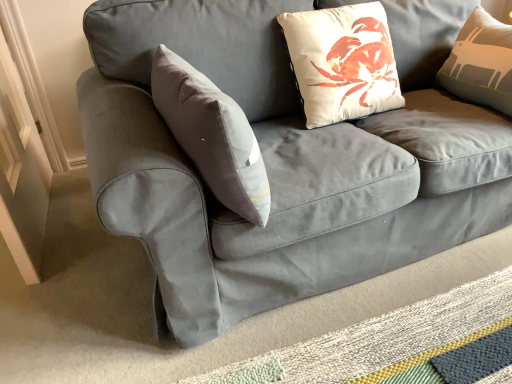
You are a GUI agent. You are given a task and a screenshot of the screen. Output one action in this format:
    pyautogui.click(x=<x>, y=<y>)
    Task: Click on the white matte pillow at upper center
    The image size is (512, 384).
    Given the screenshot: What is the action you would take?
    pyautogui.click(x=342, y=62)

What do you see at coordinates (342, 62) in the screenshot? I see `white matte pillow at upper center` at bounding box center [342, 62].

Where is `textured woven mat at lower right`? This screenshot has height=384, width=512. textured woven mat at lower right is located at coordinates (381, 339).

Describe the element at coordinates (381, 339) in the screenshot. The height and width of the screenshot is (384, 512). I see `textured woven mat at lower right` at that location.

The height and width of the screenshot is (384, 512). I want to click on white matte pillow at upper center, so click(342, 62).

Considering the positions of objects white matte pillow at upper center and textured woven mat at lower right in the image provided, who is more to the right, white matte pillow at upper center or textured woven mat at lower right?

textured woven mat at lower right.

Consider the image. Relative to textured woven mat at lower right, is white matte pillow at upper center in front or behind?

Visually, white matte pillow at upper center is located behind textured woven mat at lower right.

Between point (336, 52) and point (501, 371), which one is positioned in front?

Positioned in front is point (501, 371).

From the image's perspective, would you say white matte pillow at upper center is positioned over textured woven mat at lower right?

Yes.

From a real-world perspective, is white matte pillow at upper center under textured woven mat at lower right?

Incorrect, from a real-world perspective, white matte pillow at upper center is higher than textured woven mat at lower right.

Considering the relative sizes of white matte pillow at upper center and textured woven mat at lower right in the image provided, is white matte pillow at upper center thinner than textured woven mat at lower right?

Indeed, white matte pillow at upper center has a lesser width compared to textured woven mat at lower right.

Between white matte pillow at upper center and textured woven mat at lower right, which one has less height?

Standing shorter between the two is textured woven mat at lower right.

Consider the image. Based on their sizes in the image, would you say white matte pillow at upper center is bigger or smaller than textured woven mat at lower right?

white matte pillow at upper center is bigger than textured woven mat at lower right.

Is white matte pillow at upper center located outside textured woven mat at lower right?

That's correct, white matte pillow at upper center is outside of textured woven mat at lower right.

From the picture: Are white matte pillow at upper center and textured woven mat at lower right far apart?

No, white matte pillow at upper center is not far away from textured woven mat at lower right.

Is white matte pillow at upper center aimed at textured woven mat at lower right?

No, white matte pillow at upper center does not turn towards textured woven mat at lower right.

Can you tell me how much white matte pillow at upper center and textured woven mat at lower right differ in facing direction?

The angular difference between white matte pillow at upper center and textured woven mat at lower right is 178 degrees.

Identify the location of pillow that appears above the textured woven mat at lower right (from the image's perspective). (342, 62).

Considering the relative positions of textured woven mat at lower right and white matte pillow at upper center in the image provided, is textured woven mat at lower right to the left of white matte pillow at upper center from the viewer's perspective?

No.

Which is in front, textured woven mat at lower right or white matte pillow at upper center?

textured woven mat at lower right is more forward.

Which is behind, point (460, 316) or point (304, 109)?

Point (304, 109)

From the image's perspective, which is below, textured woven mat at lower right or white matte pillow at upper center?

textured woven mat at lower right.

In the scene shown: From a real-world perspective, is textured woven mat at lower right physically below white matte pillow at upper center?

Yes, from a real-world perspective, textured woven mat at lower right is below white matte pillow at upper center.

Does textured woven mat at lower right have a greater width compared to white matte pillow at upper center?

Yes.

Who is shorter, textured woven mat at lower right or white matte pillow at upper center?

With less height is textured woven mat at lower right.

Considering the sizes of textured woven mat at lower right and white matte pillow at upper center in the image, is textured woven mat at lower right bigger or smaller than white matte pillow at upper center?

In the image, textured woven mat at lower right appears to be smaller than white matte pillow at upper center.

Does textured woven mat at lower right contain white matte pillow at upper center?

No, textured woven mat at lower right does not contain white matte pillow at upper center.

Are textured woven mat at lower right and white matte pillow at upper center located far from each other?

No, there isn't a large distance between textured woven mat at lower right and white matte pillow at upper center.

Is textured woven mat at lower right facing towards white matte pillow at upper center?

No.

How different are the orientations of textured woven mat at lower right and white matte pillow at upper center in degrees?

The angle between the facing direction of textured woven mat at lower right and the facing direction of white matte pillow at upper center is 178 degrees.

Measure the distance from textured woven mat at lower right to white matte pillow at upper center.

textured woven mat at lower right is 31.77 inches from white matte pillow at upper center.

Find the location of `pillow on the left of textured woven mat at lower right`. pillow on the left of textured woven mat at lower right is located at coordinates (342, 62).

Locate an element on the screen. The height and width of the screenshot is (384, 512). pillow on the left of textured woven mat at lower right is located at coordinates (342, 62).

At what (x,y) coordinates should I click in order to perform the action: click on mat on the right of white matte pillow at upper center. Please return your answer as a coordinate pair (x, y). The height and width of the screenshot is (384, 512). Looking at the image, I should click on 381,339.